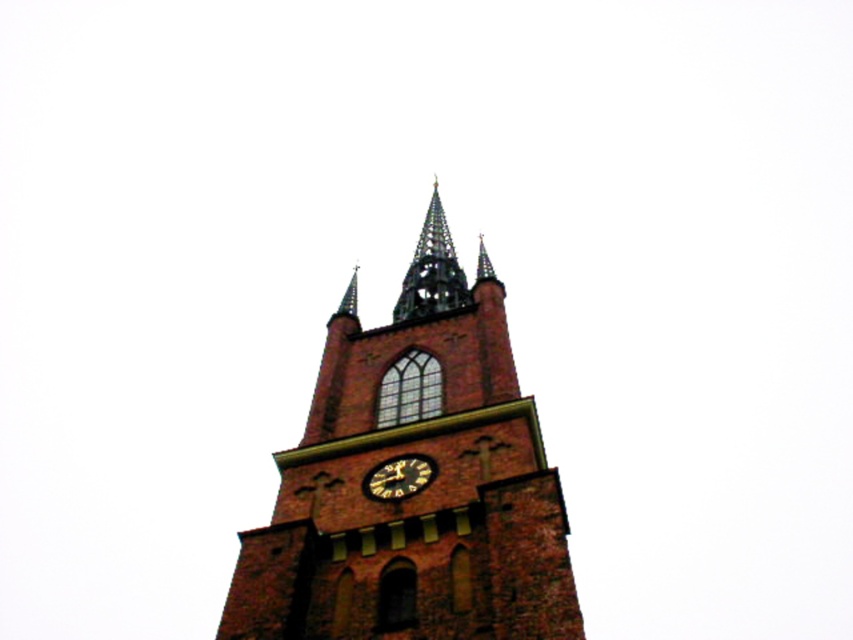
Who is shorter, brick tower at center or dark gray stone spire at upper center?

dark gray stone spire at upper center

Does point (469, 298) come closer to viewer compared to point (456, 282)?

Yes, point (469, 298) is in front of point (456, 282).

Where is `brick tower at center`? This screenshot has height=640, width=853. brick tower at center is located at coordinates (421, 490).

Does point (407, 285) come behind point (413, 474)?

Yes, it is behind point (413, 474).

Is dark gray stone spire at upper center further to the viewer compared to gold textured clock at center?

Yes, dark gray stone spire at upper center is behind gold textured clock at center.

Is point (454, 262) farther from viewer compared to point (375, 470)?

Yes.

This screenshot has height=640, width=853. Find the location of `dark gray stone spire at upper center`. dark gray stone spire at upper center is located at coordinates [x=432, y=269].

Who is lower down, brick tower at center or gold textured clock at center?

gold textured clock at center is lower down.

Can you confirm if brick tower at center is bigger than gold textured clock at center?

Correct, brick tower at center is larger in size than gold textured clock at center.

Find the location of `brick tower at center`. brick tower at center is located at coordinates (421, 490).